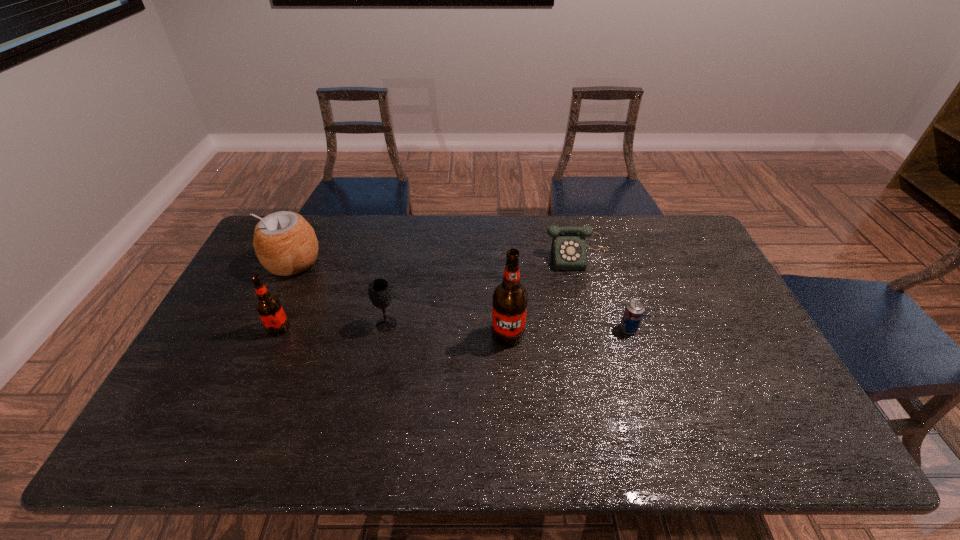
Find the location of `vacant space at the right edge`. vacant space at the right edge is located at coordinates point(729,303).

Locate an element on the screen. Image resolution: width=960 pixels, height=540 pixels. free space at the near left corner of the desktop is located at coordinates (213, 404).

The image size is (960, 540). I want to click on vacant space at the near right corner of the desktop, so (x=774, y=389).

Identify the location of unoccupied position between the third shortest object and the tallest object. This screenshot has width=960, height=540. (447, 329).

Locate an element on the screen. This screenshot has height=540, width=960. vacant point located between the shorter root beer and the telephone is located at coordinates (428, 292).

Where is `vacant region between the shorter root beer and the fourth object from right to left`? The height and width of the screenshot is (540, 960). vacant region between the shorter root beer and the fourth object from right to left is located at coordinates (332, 326).

Find the location of a particular element. unoccupied position between the telephone and the coconut is located at coordinates (436, 260).

Locate an element on the screen. The height and width of the screenshot is (540, 960). vacant area that lies between the left root beer and the beer can is located at coordinates (453, 328).

Image resolution: width=960 pixels, height=540 pixels. I want to click on vacant space in between the coconut and the right root beer, so click(x=400, y=299).

Locate an element on the screen. empty space that is in between the telephone and the wineglass is located at coordinates click(482, 290).